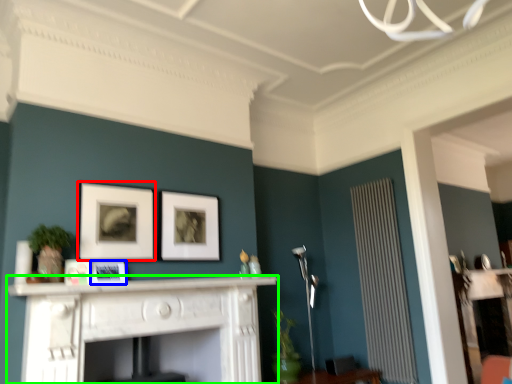
Question: Which object is positioned closest to picture frame (highlighted by a red box)? Select from picture frame (highlighted by a blue box) and fireplace (highlighted by a green box).

Choices:
 (A) picture frame
 (B) fireplace

Answer: (A)